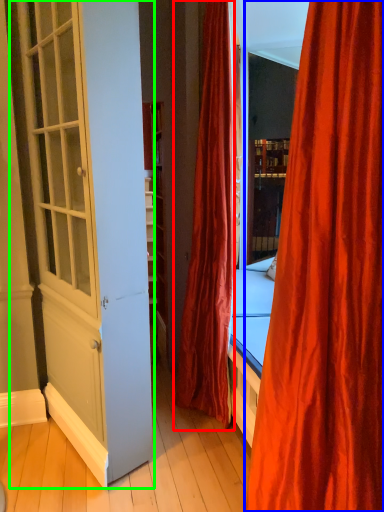
Question: Based on their relative distances, which object is farther from curtain (highlighted by a red box)? Choose from curtain (highlighted by a blue box) and screen door (highlighted by a green box).

Choices:
 (A) curtain
 (B) screen door

Answer: (A)